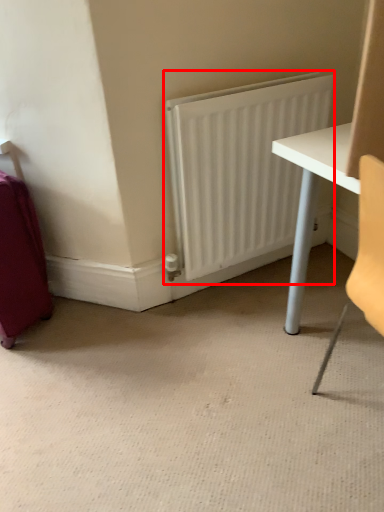
Question: Where is radiator (annotated by the red box) located in relation to luggage in the image?

Choices:
 (A) left
 (B) right

Answer: (B)